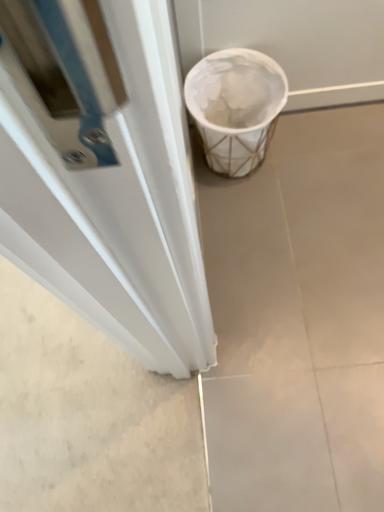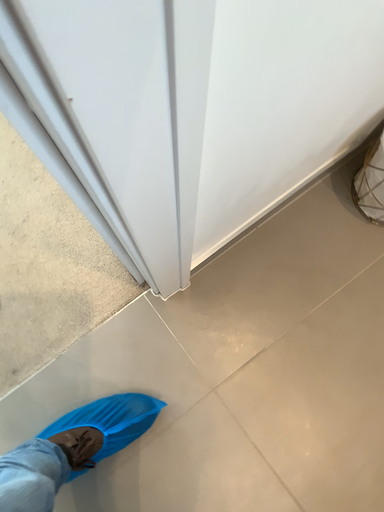
Question: Which way did the camera rotate in the video?

Choices:
 (A) rotated left
 (B) rotated right

Answer: (A)